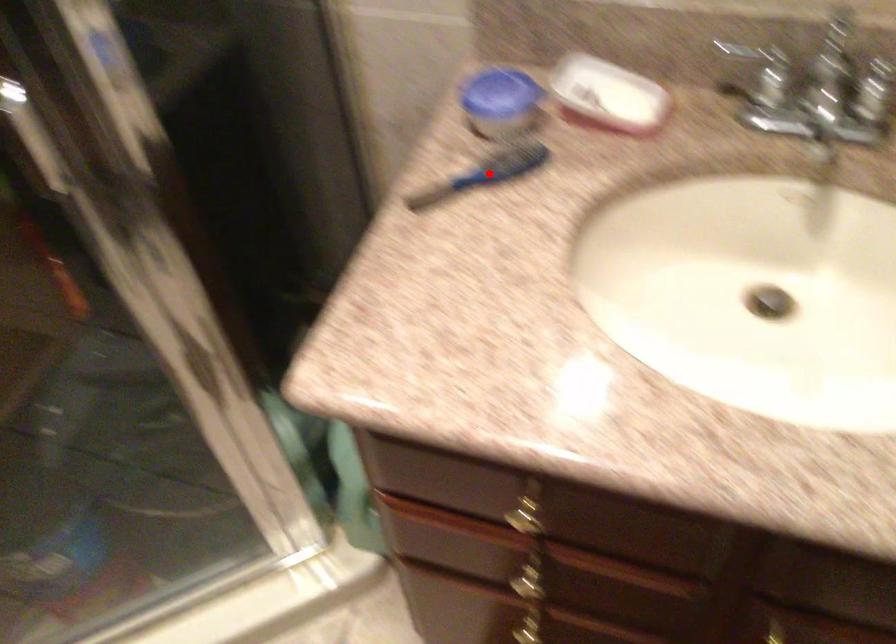
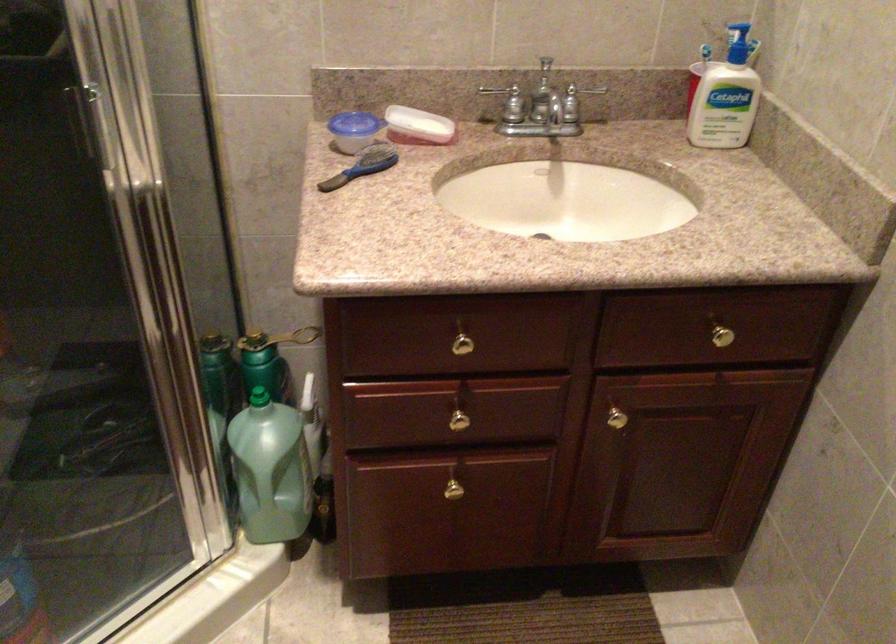
Question: I am providing you with two images of the same scene from different viewpoints. Given a red point in image1, look at the same physical point in image2. Is it:

Choices:
 (A) Closer to the viewpoint
 (B) Farther from the viewpoint

Answer: (B)